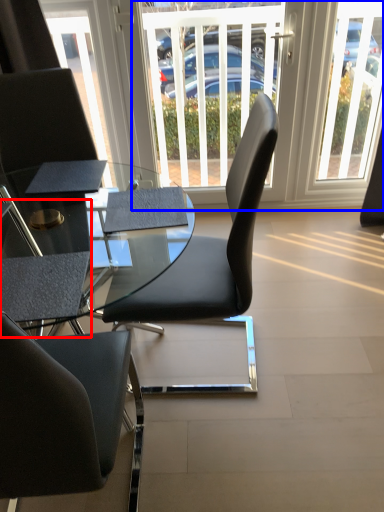
Question: Which object appears farthest to the camera in this image, armchair (highlighted by a red box) or window screen (highlighted by a blue box)?

Choices:
 (A) armchair
 (B) window screen

Answer: (B)